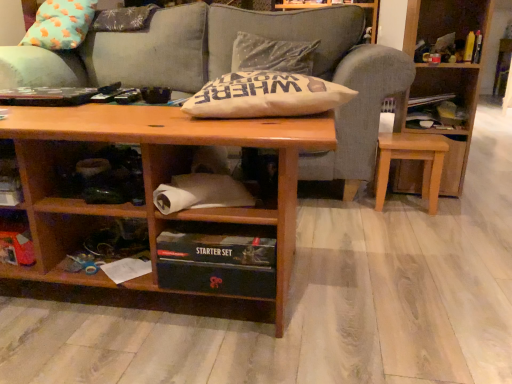
Question: From a real-world perspective, relative to light brown wooden stool at lower right, is matte cardboard paper at lower center, arranged as the 2th cabinet when ordered from the bottom, vertically above or below?

Choices:
 (A) below
 (B) above

Answer: (B)

Question: Does point (190, 173) appear closer or farther from the camera than point (384, 158)?

Choices:
 (A) farther
 (B) closer

Answer: (B)

Question: Estimate the real-world distances between objects in this image. Which object is farther from the white cotton pillow at center?

Choices:
 (A) gray fabric couch at center
 (B) light brown wooden stool at lower right
 (C) wooden bookcase at right
 (D) matte cardboard paper at lower center, the 1th cabinet from the top
 (E) black cardboard box at lower center, arranged as the 2th cabinet when viewed from the top

Answer: (A)

Question: Which object is positioned closest to the gray fabric couch at center?

Choices:
 (A) wooden bookcase at right
 (B) white cotton pillow at center
 (C) wooden box at lower left
 (D) light brown wooden stool at lower right
 (E) black cardboard box at lower center, arranged as the 1th cabinet when ordered from the bottom

Answer: (A)